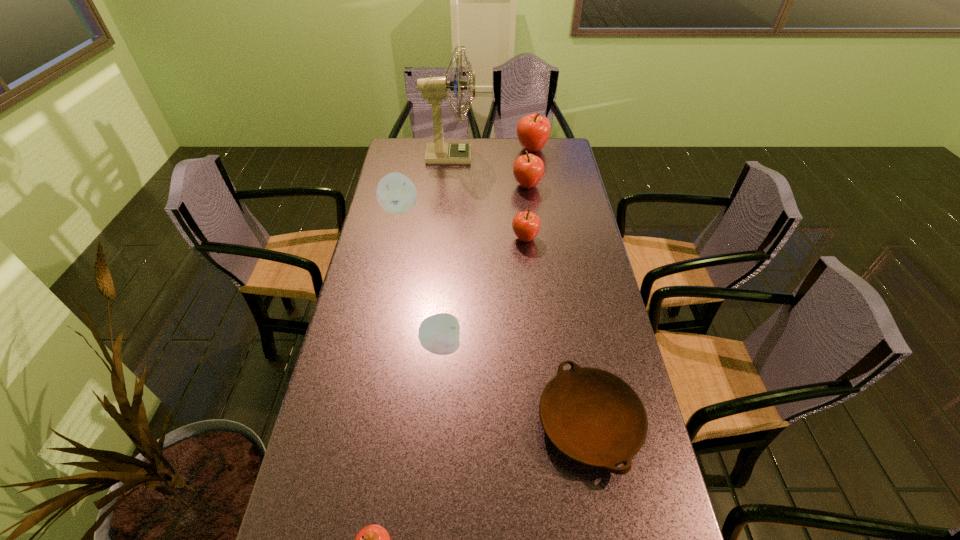
Locate an element on the screen. the sixth farthest object is located at coordinates (439, 334).

Where is `the right white apple`? the right white apple is located at coordinates (439, 334).

Where is `the seventh farthest object`? the seventh farthest object is located at coordinates (592, 416).

This screenshot has height=540, width=960. I want to click on brown plate, so click(x=592, y=416).

At what (x,y) coordinates should I click in order to perform the action: click on vacant space located 0.260m on the front-facing side of the tallest object. Please return your answer as a coordinate pair (x, y). Looking at the image, I should click on (534, 156).

The image size is (960, 540). Find the location of `vacant space located 0.100m on the left of the tallest apple`. vacant space located 0.100m on the left of the tallest apple is located at coordinates (493, 149).

At what (x,y) coordinates should I click in order to perform the action: click on free region located 0.210m on the front of the bigger white apple. Please return your answer as a coordinate pair (x, y). The height and width of the screenshot is (540, 960). Looking at the image, I should click on (390, 259).

Where is `free space located 0.050m on the left of the second farthest pink apple`? Image resolution: width=960 pixels, height=540 pixels. free space located 0.050m on the left of the second farthest pink apple is located at coordinates (500, 185).

Where is `free space located on the front of the fourth farthest apple`? free space located on the front of the fourth farthest apple is located at coordinates (531, 296).

Where is `vacant space located on the front of the right white apple`? This screenshot has height=540, width=960. vacant space located on the front of the right white apple is located at coordinates (431, 480).